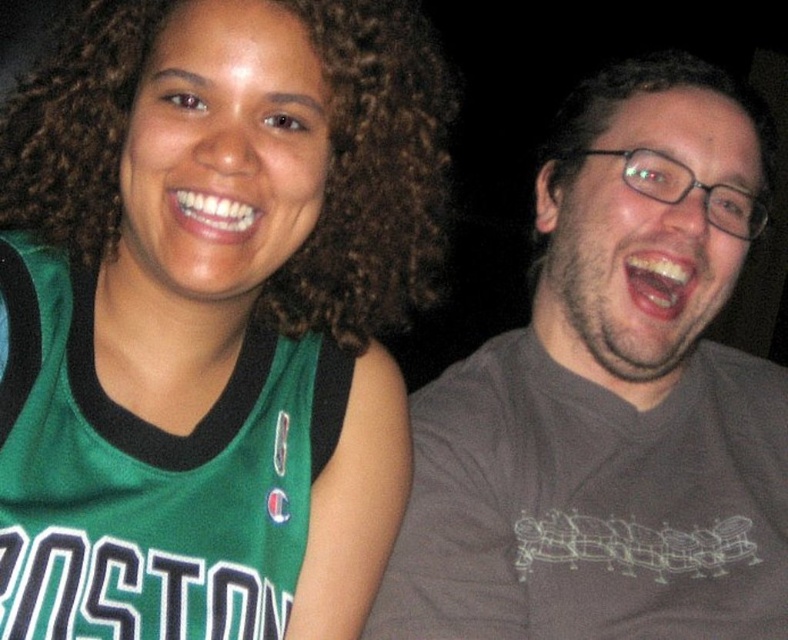
Question: Does green jersey at center have a larger size compared to gray cotton t-shirt at right?

Choices:
 (A) yes
 (B) no

Answer: (B)

Question: Which point is closer to the camera?

Choices:
 (A) (311, 458)
 (B) (584, 192)

Answer: (A)

Question: Is green jersey at center behind gray cotton t-shirt at right?

Choices:
 (A) yes
 (B) no

Answer: (B)

Question: Can you confirm if green jersey at center is thinner than gray cotton t-shirt at right?

Choices:
 (A) no
 (B) yes

Answer: (B)

Question: Which point is farther to the camera?

Choices:
 (A) (298, 512)
 (B) (545, 406)

Answer: (B)

Question: Which point appears farthest from the camera in this image?

Choices:
 (A) (556, 301)
 (B) (344, 186)

Answer: (A)